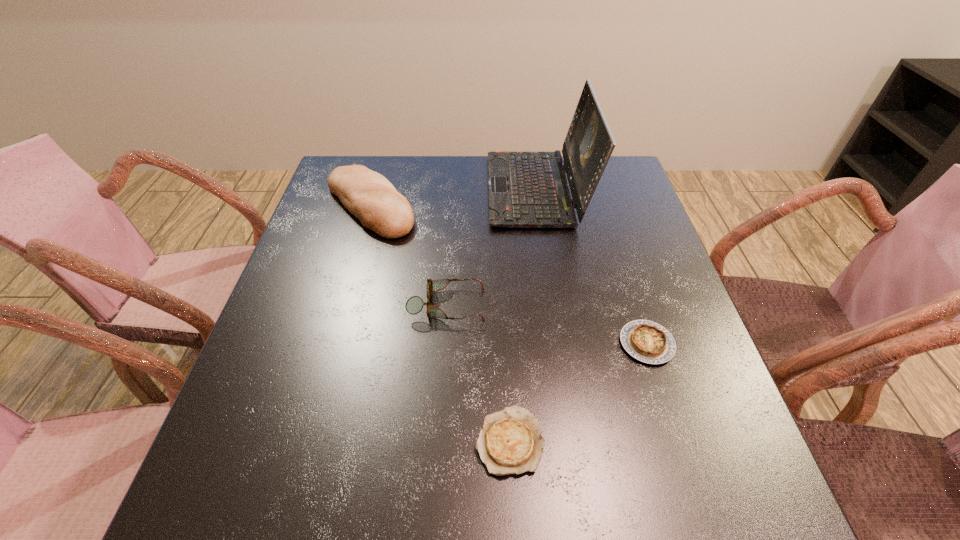
Where is `the tallest object`? the tallest object is located at coordinates (526, 189).

Where is `the second tallest object`? The height and width of the screenshot is (540, 960). the second tallest object is located at coordinates (369, 196).

Locate an element on the screen. bread is located at coordinates (369, 196).

At what (x,y) coordinates should I click in order to perform the action: click on spectacles. Please return your answer as a coordinate pair (x, y). Looking at the image, I should click on (414, 305).

Where is `the farther quiche`? Image resolution: width=960 pixels, height=540 pixels. the farther quiche is located at coordinates (646, 341).

The image size is (960, 540). Find the location of `the taller quiche`. the taller quiche is located at coordinates (646, 341).

This screenshot has height=540, width=960. What are the coordinates of `the left quiche` in the screenshot? It's located at (510, 442).

Locate an element on the screen. the shortest object is located at coordinates (510, 442).

I want to click on free space located on the screen of the tallest object, so click(376, 190).

Locate an element on the screen. The image size is (960, 540). vacant space located on the screen of the tallest object is located at coordinates (383, 190).